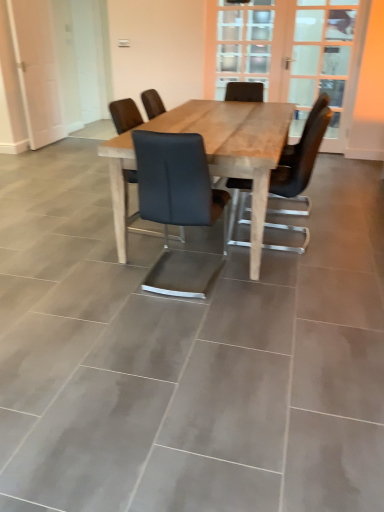
This screenshot has height=512, width=384. In order to click on vacant area that is situated to the right of black leather chair at center, acting as the 2th chair starting from the left in this screenshot , I will do `click(273, 279)`.